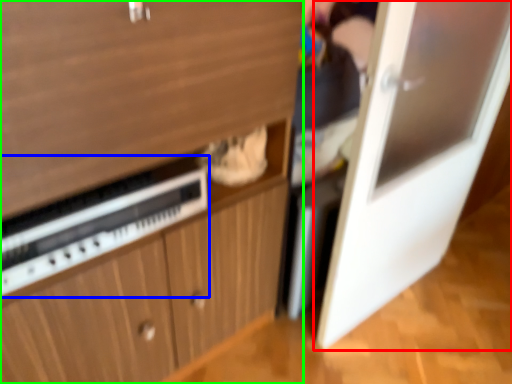
Question: Which object is the farthest from door (highlighted by a red box)? Choose among these: appliance (highlighted by a blue box) or cabinetry (highlighted by a green box).

Choices:
 (A) appliance
 (B) cabinetry

Answer: (A)